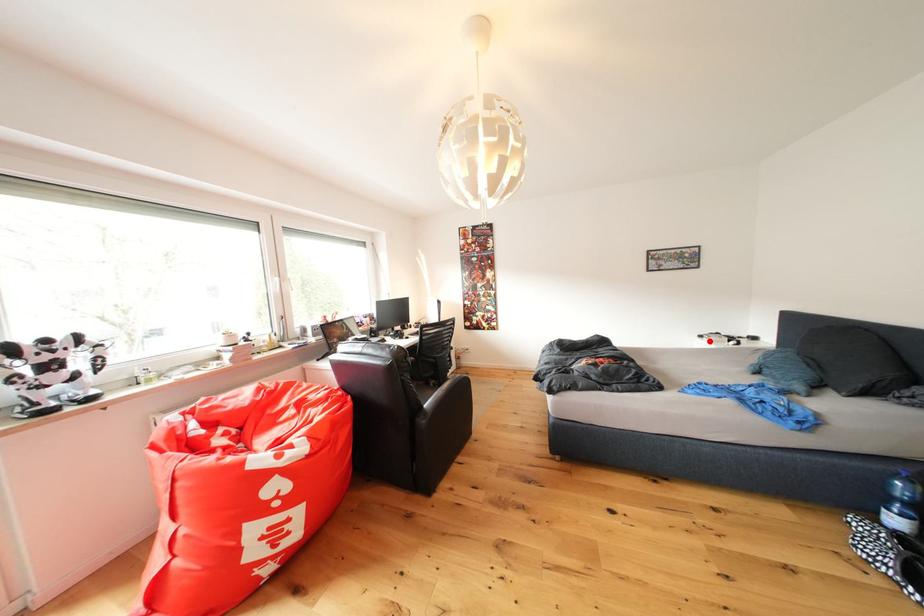
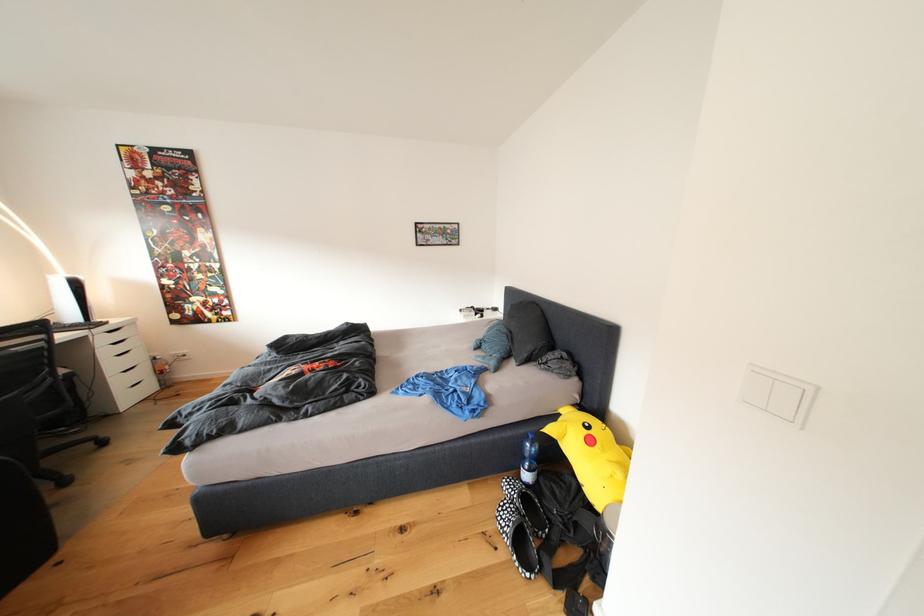
Question: I am providing you with two images of the same scene from different viewpoints. Image1 has a red point marked. In image2, the corresponding 3D location appears at what relative position? Reply with the corresponding letter.

Choices:
 (A) Closer
 (B) Farther

Answer: (A)